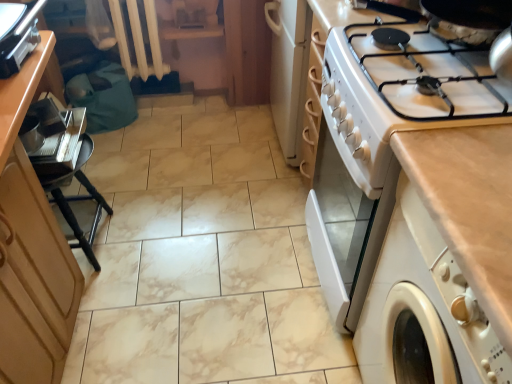
Question: Is wooden cabinet at left bigger than metallic silver toaster at upper left?

Choices:
 (A) no
 (B) yes

Answer: (B)

Question: Is wooden cabinet at left in front of metallic silver toaster at upper left?

Choices:
 (A) yes
 (B) no

Answer: (A)

Question: Is the depth of wooden cabinet at left greater than that of metallic silver toaster at upper left?

Choices:
 (A) no
 (B) yes

Answer: (A)

Question: From the image's perspective, is wooden cabinet at left under metallic silver toaster at upper left?

Choices:
 (A) yes
 (B) no

Answer: (A)

Question: Is wooden cabinet at left not within metallic silver toaster at upper left?

Choices:
 (A) yes
 (B) no

Answer: (A)

Question: Choose the correct answer: Is beige laminate countertop at right inside white glossy gas stove at upper right or outside it?

Choices:
 (A) inside
 (B) outside

Answer: (B)

Question: Would you say beige laminate countertop at right is to the left or to the right of white glossy gas stove at upper right in the picture?

Choices:
 (A) left
 (B) right

Answer: (B)

Question: Is beige laminate countertop at right wider or thinner than white glossy gas stove at upper right?

Choices:
 (A) thin
 (B) wide

Answer: (A)

Question: Relative to white glossy gas stove at upper right, is beige laminate countertop at right in front or behind?

Choices:
 (A) front
 (B) behind

Answer: (A)

Question: Choose the correct answer: Is metallic silver toaster at upper left inside wooden cabinet at left or outside it?

Choices:
 (A) outside
 (B) inside

Answer: (A)

Question: From their relative heights in the image, would you say metallic silver toaster at upper left is taller or shorter than wooden cabinet at left?

Choices:
 (A) tall
 (B) short

Answer: (B)

Question: Would you say metallic silver toaster at upper left is to the left or to the right of wooden cabinet at left in the picture?

Choices:
 (A) right
 (B) left

Answer: (A)

Question: From a real-world perspective, is metallic silver toaster at upper left physically located above or below wooden cabinet at left?

Choices:
 (A) below
 (B) above

Answer: (B)

Question: From a real-world perspective, is wooden cabinet at left above or below metallic silver tray at left?

Choices:
 (A) above
 (B) below

Answer: (B)

Question: In the image, is wooden cabinet at left on the left side or the right side of metallic silver tray at left?

Choices:
 (A) left
 (B) right

Answer: (A)